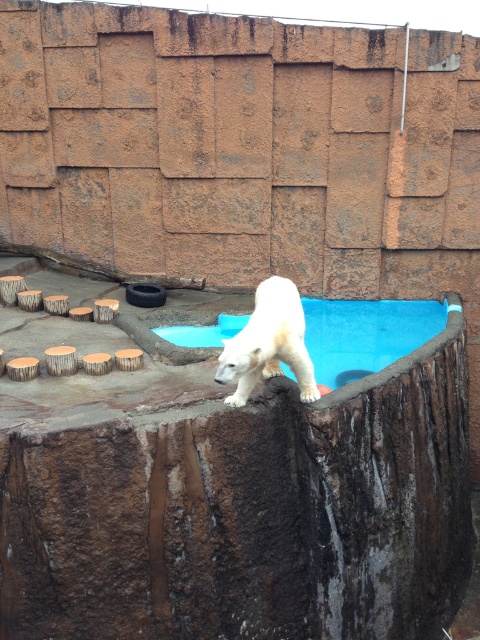
Can you confirm if blue smooth water at upper center is positioned below white fur bear at center?

No, blue smooth water at upper center is not below white fur bear at center.

Can you confirm if blue smooth water at upper center is shorter than white fur bear at center?

Incorrect, blue smooth water at upper center's height does not fall short of white fur bear at center's.

Which is behind, point (403, 304) or point (301, 376)?

The point (403, 304) is behind.

Locate an element on the screen. The image size is (480, 640). blue smooth water at upper center is located at coordinates (365, 333).